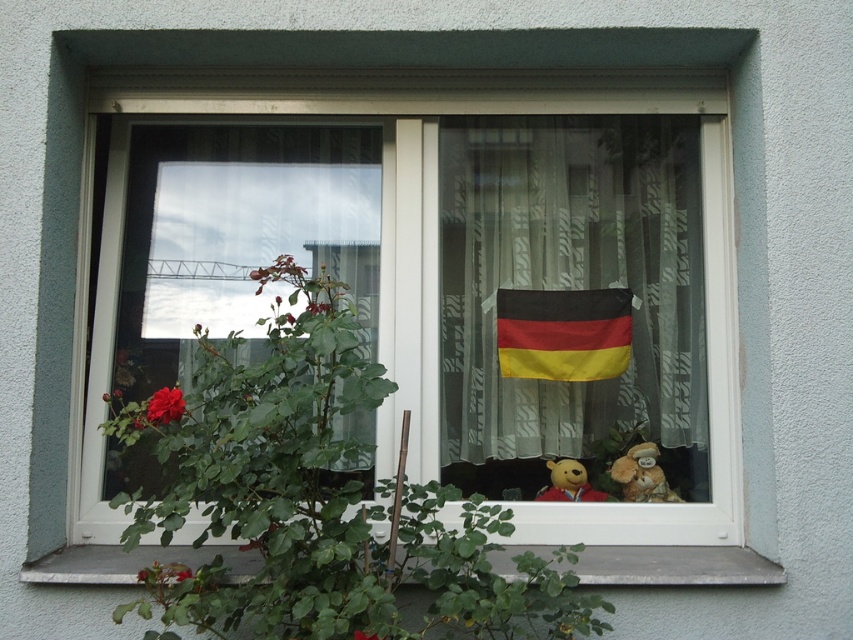
Question: Is silky sheer curtain at center in front of matte red rose at lower left?

Choices:
 (A) no
 (B) yes

Answer: (A)

Question: Which object appears closest to the camera in this image?

Choices:
 (A) velvety yellow bear at center
 (B) silky sheer curtain at center

Answer: (A)

Question: Which point is farther to the camera?

Choices:
 (A) (663, 163)
 (B) (772, 561)

Answer: (A)

Question: Is matte plastic window at center closer to camera compared to gray concrete at lower center?

Choices:
 (A) no
 (B) yes

Answer: (A)

Question: Which point is closer to the camera?

Choices:
 (A) soft plush bear at center
 (B) gray concrete at lower center

Answer: (B)

Question: Does velvety yellow bear at center come behind matte red rose at lower left?

Choices:
 (A) yes
 (B) no

Answer: (A)